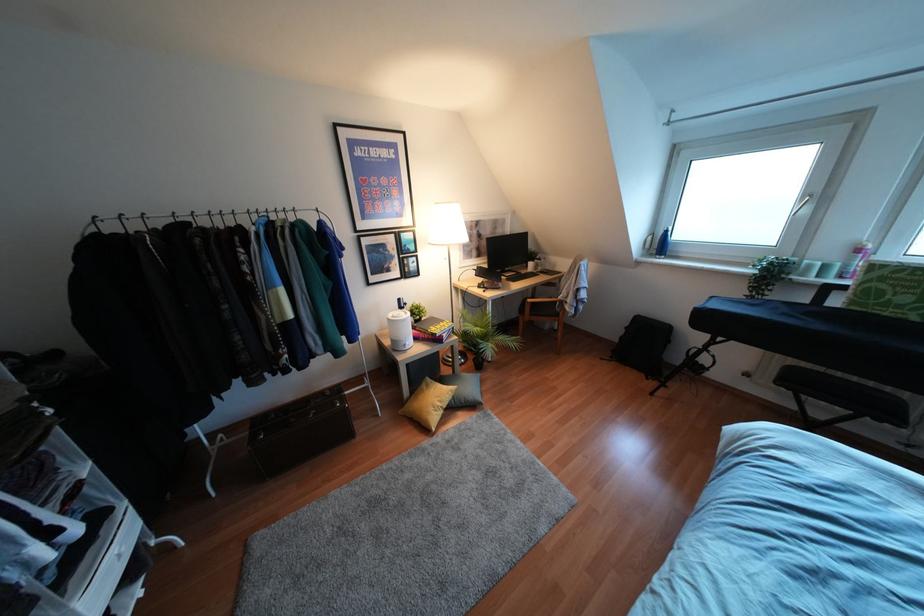
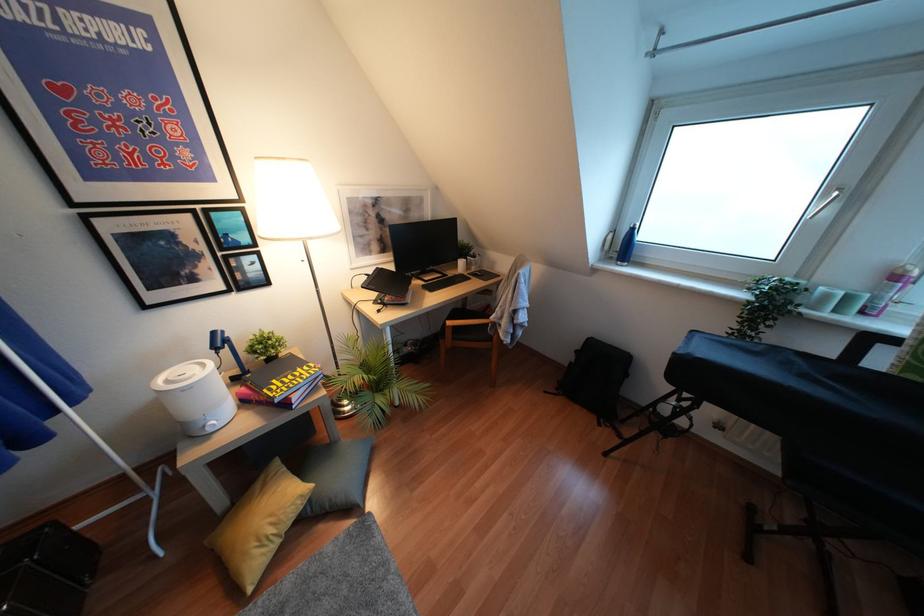
Find the pixel in the second image that matches (x=453, y=397) in the first image.

(310, 500)